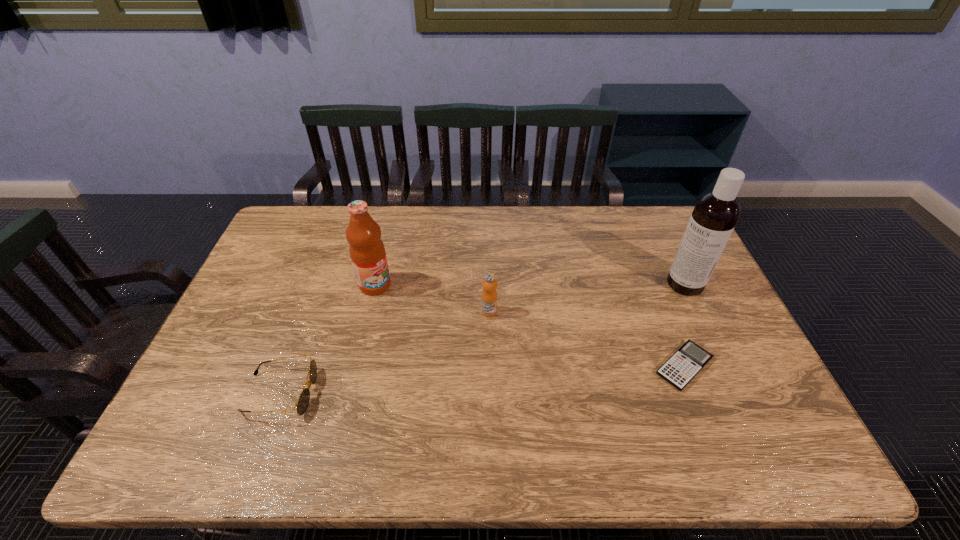
In the image, there is a desktop. Where is `vacant region at the far right corner`? The width and height of the screenshot is (960, 540). vacant region at the far right corner is located at coordinates (674, 213).

Find the location of `free spot at the near right corner of the desktop`. free spot at the near right corner of the desktop is located at coordinates (755, 387).

Locate an element on the screen. The width and height of the screenshot is (960, 540). vacant space in between the fourth tallest object and the second object from left to right is located at coordinates (327, 339).

The width and height of the screenshot is (960, 540). What are the coordinates of `unoccupied position between the third object from right to left and the fruit juice` in the screenshot? It's located at (432, 299).

Where is `free space between the fourth object from right to left and the calculator`? Image resolution: width=960 pixels, height=540 pixels. free space between the fourth object from right to left and the calculator is located at coordinates (530, 326).

You are a GUI agent. You are given a task and a screenshot of the screen. Output one action in this format:
    pyautogui.click(x=<x>, y=<y>)
    Task: Click on the free space between the calculator and the sunglasses
    Image resolution: width=960 pixels, height=540 pixels.
    Given the screenshot: What is the action you would take?
    pyautogui.click(x=482, y=380)

Identify the location of free spot between the third tallest object and the dishwasher detergent. The height and width of the screenshot is (540, 960). (588, 298).

The width and height of the screenshot is (960, 540). In order to click on unoccupied position between the tallest object and the leftmost object in this screenshot , I will do coord(483,339).

Image resolution: width=960 pixels, height=540 pixels. What are the coordinates of `free space between the sunglasses and the shortest object` in the screenshot? It's located at (482, 380).

This screenshot has width=960, height=540. Find the location of `free point between the calculator and the sunglasses`. free point between the calculator and the sunglasses is located at coordinates (482, 380).